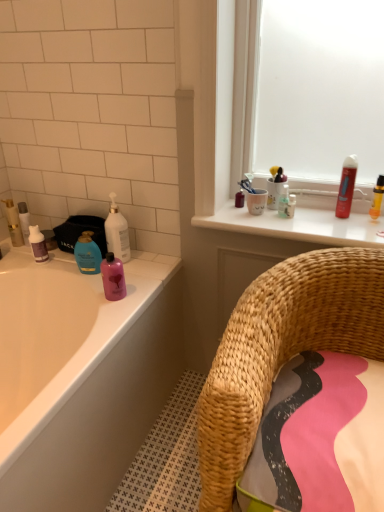
Where is `vacant area that lies to the right of pink glossy bottle at upper left, which appears as the second mouthwash when viewed from the left`? This screenshot has height=512, width=384. vacant area that lies to the right of pink glossy bottle at upper left, which appears as the second mouthwash when viewed from the left is located at coordinates pos(141,289).